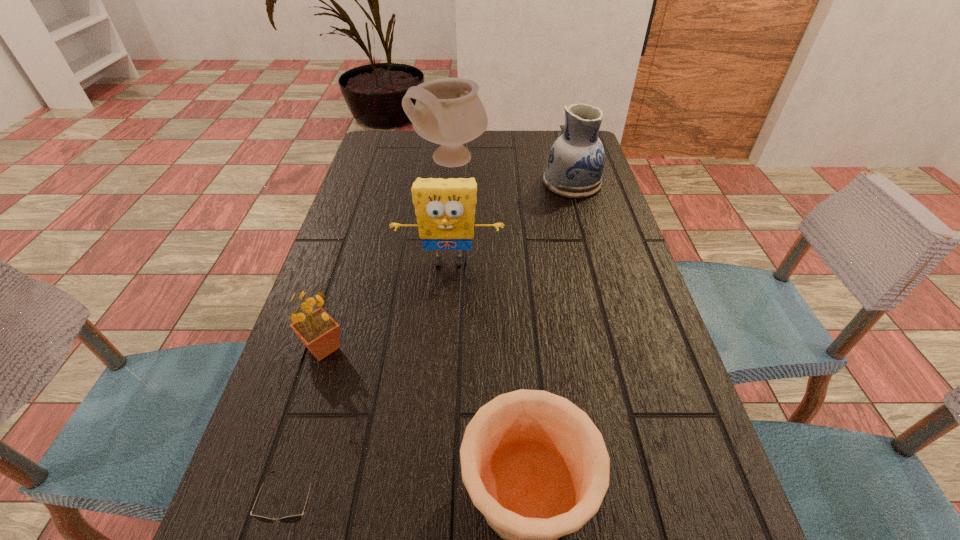
The width and height of the screenshot is (960, 540). I want to click on vacant region between the fourth nearest object and the third nearest object, so click(386, 305).

Locate an element on the screen. free point between the fourth nearest object and the rightmost pottery is located at coordinates coord(511,222).

Where is `object identified as the fifth closest to the shortest pottery`? This screenshot has height=540, width=960. object identified as the fifth closest to the shortest pottery is located at coordinates (448, 111).

Select which object appears as the second closest to the shortest object. Please provide its 2D coordinates. Your answer should be formatted as a tuple, i.e. [(x, y)], where the tuple contains the x and y coordinates of a point satisfying the conditions above.

[(320, 333)]

Select which pottery appears as the third closest to the fourth farthest object. Please provide its 2D coordinates. Your answer should be formatted as a tuple, i.e. [(x, y)], where the tuple contains the x and y coordinates of a point satisfying the conditions above.

[(576, 160)]

The height and width of the screenshot is (540, 960). Identify the location of pottery that is the second closest one to the shortest pottery. (448, 111).

The image size is (960, 540). Find the location of `free space that satisfies the following two spatial constraints: 1. on the face of the sponge; 2. at the front of the third nearest object with flowers visible`. free space that satisfies the following two spatial constraints: 1. on the face of the sponge; 2. at the front of the third nearest object with flowers visible is located at coordinates (443, 348).

Locate an element on the screen. This screenshot has width=960, height=540. vacant space that satisfies the following two spatial constraints: 1. on the front side of the tallest pottery; 2. at the front of the fourth tallest object with flowers visible is located at coordinates (433, 348).